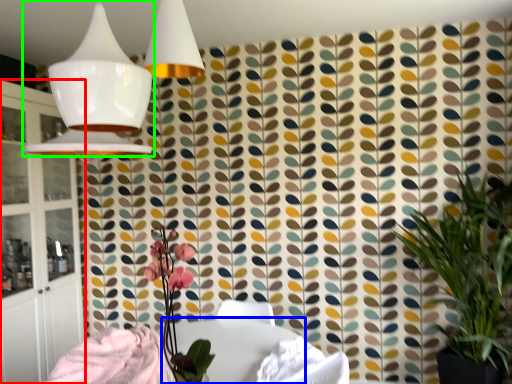
Question: Which object is the farthest from cabinetry (highlighted by a red box)? Choose among these: round table (highlighted by a blue box) or lamp (highlighted by a green box).

Choices:
 (A) round table
 (B) lamp

Answer: (B)